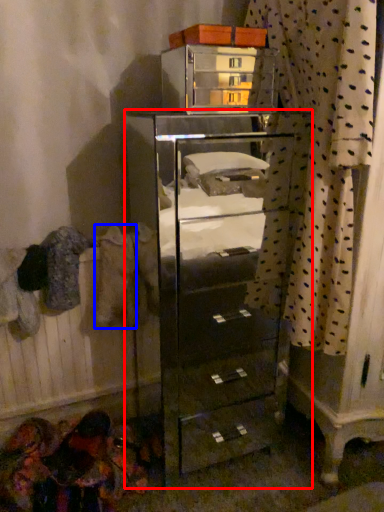
Question: Which of the following is the farthest to the observer, chest of drawers (highlighted by a red box) or clothing (highlighted by a blue box)?

Choices:
 (A) chest of drawers
 (B) clothing

Answer: (B)